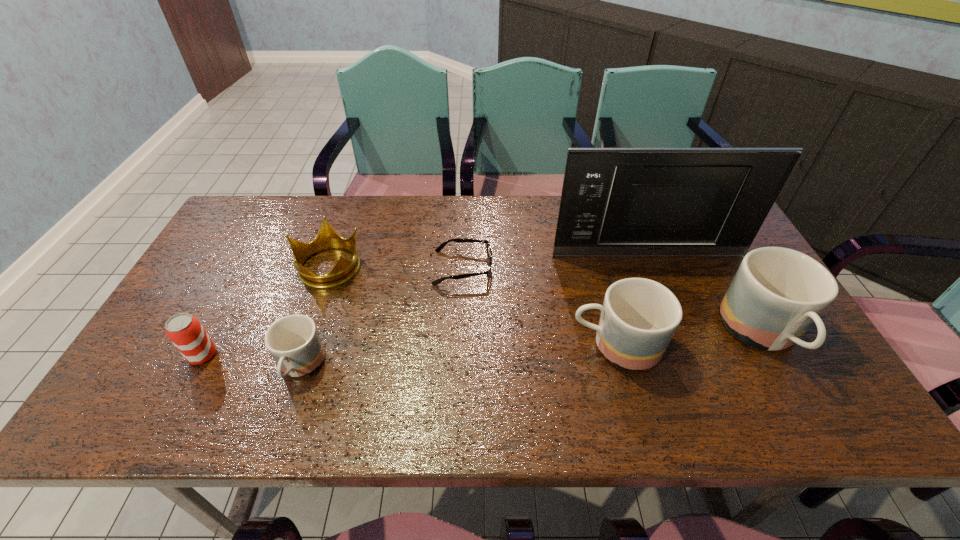
At what (x,y) coordinates should I click in order to perform the action: click on free space located 0.100m on the side with the handle of the second tallest mug. Please return your answer as a coordinate pair (x, y). The height and width of the screenshot is (540, 960). Looking at the image, I should click on (528, 346).

Locate an element on the screen. The height and width of the screenshot is (540, 960). free space located on the side with the handle of the second tallest mug is located at coordinates (466, 346).

Where is `vacant region located on the front panel of the tallest object`? The width and height of the screenshot is (960, 540). vacant region located on the front panel of the tallest object is located at coordinates (680, 337).

Identify the location of free space located 0.220m on the back of the crown. The image size is (960, 540). (351, 202).

The width and height of the screenshot is (960, 540). In order to click on vacant area situated on the front-facing side of the shortest object in this screenshot , I will do `click(604, 268)`.

The width and height of the screenshot is (960, 540). What are the coordinates of `free location located 0.060m on the front of the leftmost object` in the screenshot? It's located at (184, 389).

Identify the location of beer can located in the near edge section of the desktop. The width and height of the screenshot is (960, 540). (187, 334).

The image size is (960, 540). What are the coordinates of `object that is positioned at the left edge` in the screenshot? It's located at (187, 334).

The height and width of the screenshot is (540, 960). What are the coordinates of `mug positioned at the right edge` in the screenshot? It's located at 777,293.

You are a GUI agent. You are given a task and a screenshot of the screen. Output one action in this format:
    pyautogui.click(x=<x>, y=<y>)
    Task: Click on the microwave oven that is at the right edge
    The height and width of the screenshot is (540, 960).
    Given the screenshot: What is the action you would take?
    pyautogui.click(x=624, y=202)